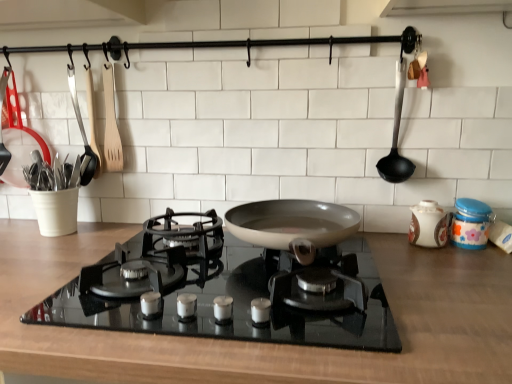
This screenshot has height=384, width=512. What do you see at coordinates (111, 124) in the screenshot?
I see `wooden spatula at upper left, the third kitchen appliance when ordered from left to right` at bounding box center [111, 124].

This screenshot has height=384, width=512. I want to click on white plastic utensil holder at left, placed as the fifth kitchen appliance when sorted from right to left, so click(19, 141).

Where is `wooden spatula at left, which ranks as the 4th kitchen appliance in right-to-left order`? wooden spatula at left, which ranks as the 4th kitchen appliance in right-to-left order is located at coordinates (82, 132).

This screenshot has width=512, height=384. What do you see at coordinates (471, 224) in the screenshot?
I see `blue glossy jar at right, marked as the 1th kitchen appliance in a right-to-left arrangement` at bounding box center [471, 224].

What do you see at coordinates (428, 225) in the screenshot?
I see `porcelain jar at right, which is counted as the 2th kitchen appliance, starting from the right` at bounding box center [428, 225].

The image size is (512, 384). In order to click on wooden spatula at upper left, placed as the third kitchen appliance when sorted from right to left in this screenshot , I will do `click(111, 124)`.

Does white plastic utensil holder at left, the 1th kitchen appliance from the left, have a greater height compared to porcelain jar at right, the fourth kitchen appliance when ordered from left to right?

Yes, white plastic utensil holder at left, the 1th kitchen appliance from the left, is taller than porcelain jar at right, the fourth kitchen appliance when ordered from left to right.

Does white plastic utensil holder at left, the 1th kitchen appliance from the left, have a greater width compared to porcelain jar at right, which is counted as the 2th kitchen appliance, starting from the right?

Yes.

In the image, is white plastic utensil holder at left, placed as the fifth kitchen appliance when sorted from right to left, on the left side or the right side of porcelain jar at right, which is counted as the 2th kitchen appliance, starting from the right?

From the image, it's evident that white plastic utensil holder at left, placed as the fifth kitchen appliance when sorted from right to left, is to the left of porcelain jar at right, which is counted as the 2th kitchen appliance, starting from the right.

From a real-world perspective, between white plastic utensil holder at left, the 1th kitchen appliance from the left, and porcelain jar at right, which is counted as the 2th kitchen appliance, starting from the right, who is vertically higher?

In real-world perspective, white plastic utensil holder at left, the 1th kitchen appliance from the left, is above.

In terms of height, does blue glossy jar at right, the 5th kitchen appliance from the left, look taller or shorter compared to porcelain jar at right, which is counted as the 2th kitchen appliance, starting from the right?

In the image, blue glossy jar at right, the 5th kitchen appliance from the left, appears to be shorter than porcelain jar at right, which is counted as the 2th kitchen appliance, starting from the right.

Which object is thinner, blue glossy jar at right, the 5th kitchen appliance from the left, or porcelain jar at right, which is counted as the 2th kitchen appliance, starting from the right?

blue glossy jar at right, the 5th kitchen appliance from the left.

Would you say blue glossy jar at right, marked as the 1th kitchen appliance in a right-to-left arrangement, is a long distance from porcelain jar at right, the fourth kitchen appliance when ordered from left to right?

blue glossy jar at right, marked as the 1th kitchen appliance in a right-to-left arrangement, is actually quite close to porcelain jar at right, the fourth kitchen appliance when ordered from left to right.

Can porcelain jar at right, the fourth kitchen appliance when ordered from left to right, be found inside blue glossy jar at right, marked as the 1th kitchen appliance in a right-to-left arrangement?

No, porcelain jar at right, the fourth kitchen appliance when ordered from left to right, is not surrounded by blue glossy jar at right, marked as the 1th kitchen appliance in a right-to-left arrangement.

From the image's perspective, which object appears higher, wooden spatula at left, which ranks as the 4th kitchen appliance in right-to-left order, or porcelain jar at right, which is counted as the 2th kitchen appliance, starting from the right?

From the image's view, wooden spatula at left, which ranks as the 4th kitchen appliance in right-to-left order, is above.

From the picture: Does wooden spatula at left, which ranks as the 4th kitchen appliance in right-to-left order, turn towards porcelain jar at right, the fourth kitchen appliance when ordered from left to right?

No.

Is wooden spatula at left, which ranks as the 4th kitchen appliance in right-to-left order, wider than porcelain jar at right, the fourth kitchen appliance when ordered from left to right?

In fact, wooden spatula at left, which ranks as the 4th kitchen appliance in right-to-left order, might be narrower than porcelain jar at right, the fourth kitchen appliance when ordered from left to right.

Is porcelain jar at right, which is counted as the 2th kitchen appliance, starting from the right, a part of wooden spatula at left, which ranks as the 4th kitchen appliance in right-to-left order?

No, wooden spatula at left, which ranks as the 4th kitchen appliance in right-to-left order, does not contain porcelain jar at right, which is counted as the 2th kitchen appliance, starting from the right.

What's the angular difference between porcelain jar at right, the fourth kitchen appliance when ordered from left to right, and black glass gas stove at center's facing directions?

The angular difference between porcelain jar at right, the fourth kitchen appliance when ordered from left to right, and black glass gas stove at center is 0.000548 degrees.

Does porcelain jar at right, the fourth kitchen appliance when ordered from left to right, come in front of black glass gas stove at center?

No, porcelain jar at right, the fourth kitchen appliance when ordered from left to right, is further to the viewer.

Is porcelain jar at right, which is counted as the 2th kitchen appliance, starting from the right, outside of black glass gas stove at center?

Yes.

What's the angular difference between black plastic ladle at right and wooden spatula at left, which appears as the 2th kitchen appliance when viewed from the left,'s facing directions?

They differ by 0.00205 degrees in their facing directions.

Identify the location of the 1st kitchen appliance directly above the black plastic ladle at right (from a real-world perspective). Image resolution: width=512 pixels, height=384 pixels. (82, 132).

Looking at this image, is black plastic ladle at right wider or thinner than wooden spatula at left, which ranks as the 4th kitchen appliance in right-to-left order?

In the image, black plastic ladle at right appears to be wider than wooden spatula at left, which ranks as the 4th kitchen appliance in right-to-left order.

Does black plastic ladle at right appear on the right side of wooden spatula at left, which ranks as the 4th kitchen appliance in right-to-left order?

Indeed, black plastic ladle at right is positioned on the right side of wooden spatula at left, which ranks as the 4th kitchen appliance in right-to-left order.

Does black glass gas stove at center turn towards wooden spatula at upper left, placed as the third kitchen appliance when sorted from right to left?

No, black glass gas stove at center is not oriented towards wooden spatula at upper left, placed as the third kitchen appliance when sorted from right to left.

Who is bigger, black glass gas stove at center or wooden spatula at upper left, placed as the third kitchen appliance when sorted from right to left?

black glass gas stove at center is bigger.

Where is `kitchen appliance that is the 1st object to the left of the black glass gas stove at center, starting at the anchor`? This screenshot has width=512, height=384. kitchen appliance that is the 1st object to the left of the black glass gas stove at center, starting at the anchor is located at coordinates (111, 124).

Can you confirm if porcelain jar at right, which is counted as the 2th kitchen appliance, starting from the right, is thinner than black plastic ladle at right?

No, porcelain jar at right, which is counted as the 2th kitchen appliance, starting from the right, is not thinner than black plastic ladle at right.

Consider the image. Is porcelain jar at right, the fourth kitchen appliance when ordered from left to right, not within black plastic ladle at right?

That's correct, porcelain jar at right, the fourth kitchen appliance when ordered from left to right, is outside of black plastic ladle at right.

Locate an element on the screen. Image resolution: width=512 pixels, height=384 pixels. the 2nd kitchen appliance directly beneath the white plastic utensil holder at left, placed as the fifth kitchen appliance when sorted from right to left (from a real-world perspective) is located at coordinates tap(428, 225).

Find the location of a particular element. The height and width of the screenshot is (384, 512). the 1st kitchen appliance above the blue glossy jar at right, marked as the 1th kitchen appliance in a right-to-left arrangement (from the image's perspective) is located at coordinates (428, 225).

When comparing their distances from blue glossy jar at right, marked as the 1th kitchen appliance in a right-to-left arrangement, does black glass gas stove at center or white plastic utensil holder at left, placed as the fifth kitchen appliance when sorted from right to left, seem closer?

black glass gas stove at center is positioned closer to the anchor blue glossy jar at right, marked as the 1th kitchen appliance in a right-to-left arrangement.

Estimate the real-world distances between objects in this image. Which object is closer to black plastic ladle at right, black glass gas stove at center or blue glossy jar at right, the 5th kitchen appliance from the left?

blue glossy jar at right, the 5th kitchen appliance from the left.

Looking at the image, which one is located closer to porcelain jar at right, the fourth kitchen appliance when ordered from left to right, black glass gas stove at center or blue glossy jar at right, marked as the 1th kitchen appliance in a right-to-left arrangement?

Among the two, blue glossy jar at right, marked as the 1th kitchen appliance in a right-to-left arrangement, is located nearer to porcelain jar at right, the fourth kitchen appliance when ordered from left to right.

Looking at the image, which one is located further to white plastic utensil holder at left, the 1th kitchen appliance from the left, black plastic ladle at right or black glass gas stove at center?

black plastic ladle at right is further to white plastic utensil holder at left, the 1th kitchen appliance from the left.

Which object lies further to the anchor point blue glossy jar at right, marked as the 1th kitchen appliance in a right-to-left arrangement, white plastic utensil holder at left, the 1th kitchen appliance from the left, or wooden spatula at left, which appears as the 2th kitchen appliance when viewed from the left?

Among the two, white plastic utensil holder at left, the 1th kitchen appliance from the left, is located further to blue glossy jar at right, marked as the 1th kitchen appliance in a right-to-left arrangement.

Based on their spatial positions, is wooden spatula at left, which appears as the 2th kitchen appliance when viewed from the left, or white plastic utensil holder at left, placed as the fifth kitchen appliance when sorted from right to left, further from blue glossy jar at right, marked as the 1th kitchen appliance in a right-to-left arrangement?

white plastic utensil holder at left, placed as the fifth kitchen appliance when sorted from right to left.

Considering their positions, is black glass gas stove at center positioned closer to blue glossy jar at right, marked as the 1th kitchen appliance in a right-to-left arrangement, than porcelain jar at right, which is counted as the 2th kitchen appliance, starting from the right?

porcelain jar at right, which is counted as the 2th kitchen appliance, starting from the right, lies closer to blue glossy jar at right, marked as the 1th kitchen appliance in a right-to-left arrangement, than the other object.

Looking at this image, which object lies nearer to the anchor point black plastic ladle at right, black glass gas stove at center or porcelain jar at right, the fourth kitchen appliance when ordered from left to right?

Based on the image, porcelain jar at right, the fourth kitchen appliance when ordered from left to right, appears to be nearer to black plastic ladle at right.

At what (x,y) coordinates should I click in order to perform the action: click on spoon situated between white plastic utensil holder at left, the 1th kitchen appliance from the left, and porcelain jar at right, the fourth kitchen appliance when ordered from left to right, from left to right. Please return your answer as a coordinate pair (x, y). This screenshot has width=512, height=384. Looking at the image, I should click on (396, 137).

In order to click on kitchen appliance between black plastic ladle at right and blue glossy jar at right, marked as the 1th kitchen appliance in a right-to-left arrangement, in the up-down direction in this screenshot , I will do `click(428, 225)`.

Locate an element on the screen. Image resolution: width=512 pixels, height=384 pixels. gas stove between wooden spatula at left, which appears as the 2th kitchen appliance when viewed from the left, and black plastic ladle at right from left to right is located at coordinates (228, 291).

Identify the location of gas stove located between white plastic utensil holder at left, placed as the fifth kitchen appliance when sorted from right to left, and black plastic ladle at right in the left-right direction. (228, 291).